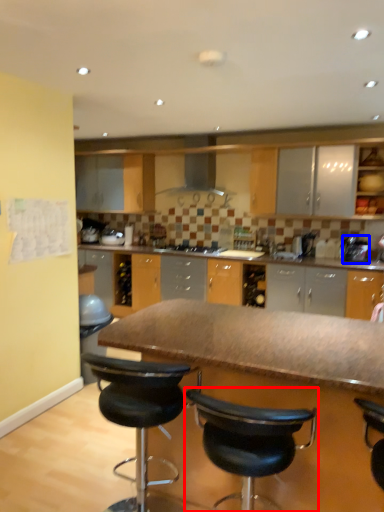
Question: Which point is closer to the camera, chair (highlighted by a red box) or appliance (highlighted by a blue box)?

Choices:
 (A) chair
 (B) appliance

Answer: (A)